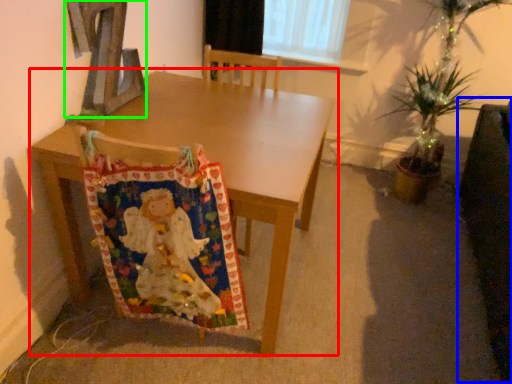
Question: Which object is the farthest from table (highlighted by a red box)? Choose among these: swivel chair (highlighted by a blue box) or alphabet (highlighted by a green box).

Choices:
 (A) swivel chair
 (B) alphabet

Answer: (A)